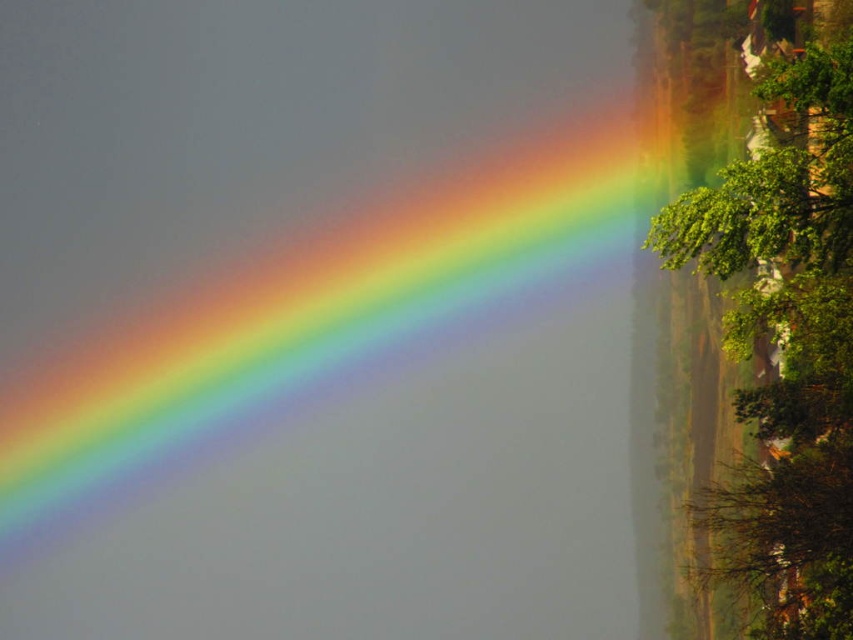
Question: Can you confirm if rainbow at upper left is positioned to the left of green leafy tree at upper right?

Choices:
 (A) no
 (B) yes

Answer: (B)

Question: Among these points, which one is farthest from the camera?

Choices:
 (A) (752, 253)
 (B) (415, 301)

Answer: (B)

Question: Which point is closer to the camera?

Choices:
 (A) (705, 248)
 (B) (33, 420)

Answer: (A)

Question: Is rainbow at upper left closer to camera compared to green leafy tree at upper right?

Choices:
 (A) yes
 (B) no

Answer: (B)

Question: Does rainbow at upper left have a greater width compared to green leafy tree at upper right?

Choices:
 (A) no
 (B) yes

Answer: (B)